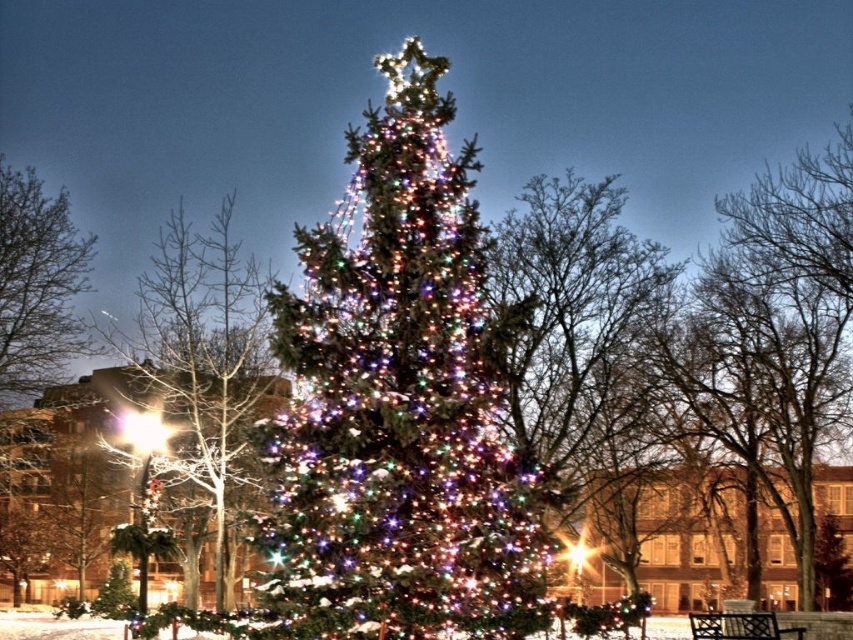
Question: Can you confirm if iridescent glass christmas tree at center is positioned to the right of icy white snow-covered tree at center?

Choices:
 (A) yes
 (B) no

Answer: (A)

Question: Which object is the closest to the iridescent glass christmas tree at center?

Choices:
 (A) green matte tree at left
 (B) icy white snow-covered tree at center

Answer: (B)

Question: Among these objects, which one is farthest from the camera?

Choices:
 (A) green matte tree at left
 (B) iridescent glass christmas tree at center

Answer: (A)

Question: From the image, what is the correct spatial relationship of iridescent glass christmas tree at center in relation to green matte tree at left?

Choices:
 (A) below
 (B) above

Answer: (B)

Question: Which point is closer to the camera?

Choices:
 (A) (408, 280)
 (B) (47, 218)

Answer: (A)

Question: Does iridescent glass christmas tree at center appear under icy white snow-covered tree at center?

Choices:
 (A) no
 (B) yes

Answer: (A)